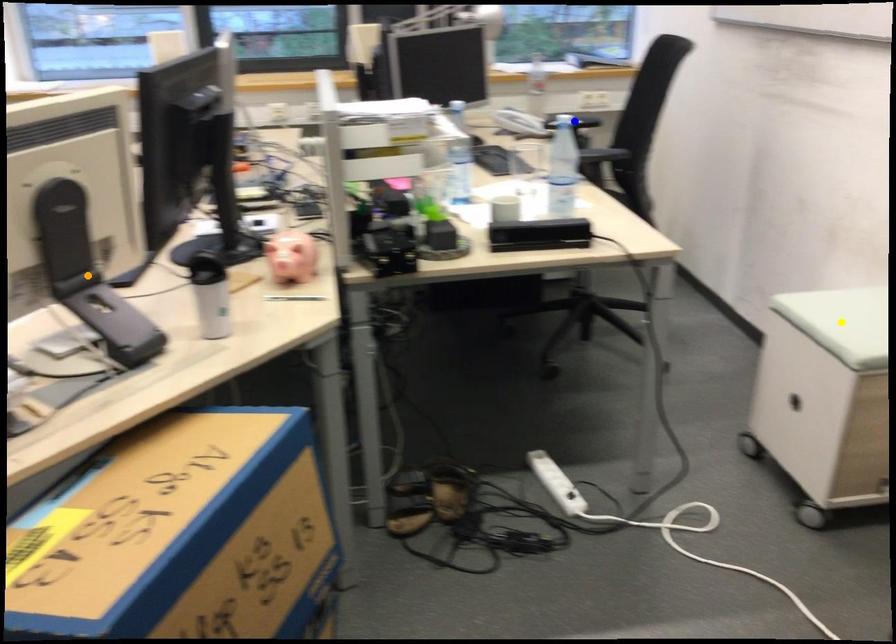
Order these from nearest to farthest:
orange point
blue point
yellow point

blue point, yellow point, orange point